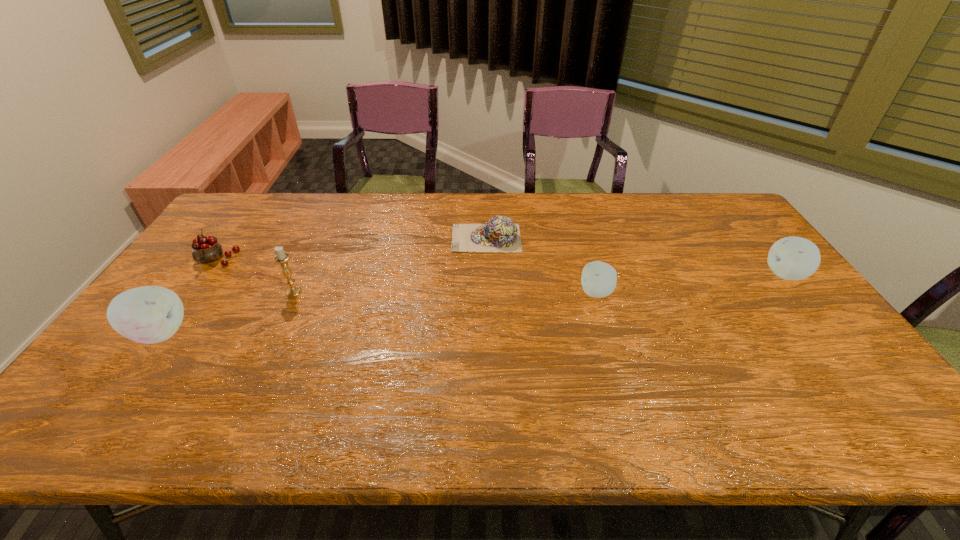
The width and height of the screenshot is (960, 540). In order to click on cherry at the left edge in this screenshot , I will do `click(207, 249)`.

Where is `object that is at the right edge`? This screenshot has width=960, height=540. object that is at the right edge is located at coordinates (791, 258).

Identify the location of free space at the far edge of the desktop. The image size is (960, 540). (633, 197).

You are a GUI agent. You are given a task and a screenshot of the screen. Output one action in this format:
    pyautogui.click(x=<x>, y=<y>)
    Task: Click on the vacant space at the near edge
    Image resolution: width=960 pixels, height=540 pixels.
    Given the screenshot: What is the action you would take?
    pyautogui.click(x=783, y=374)

In the image, there is a desktop. Where is `vacant space at the left edge`? Image resolution: width=960 pixels, height=540 pixels. vacant space at the left edge is located at coordinates (182, 276).

This screenshot has width=960, height=540. Identify the location of free space at the right edge of the desktop. (818, 334).

Find the location of `free spot between the fifth object from left to right and the leftmost apple`. free spot between the fifth object from left to right and the leftmost apple is located at coordinates (378, 313).

I want to click on vacant space in between the leftmost apple and the second shortest apple, so click(472, 304).

Locate an element on the screen. empty location between the leftmost apple and the cherry is located at coordinates click(188, 296).

Where is `vacant region between the candle holder and the shortest apple`? The height and width of the screenshot is (540, 960). vacant region between the candle holder and the shortest apple is located at coordinates (445, 292).